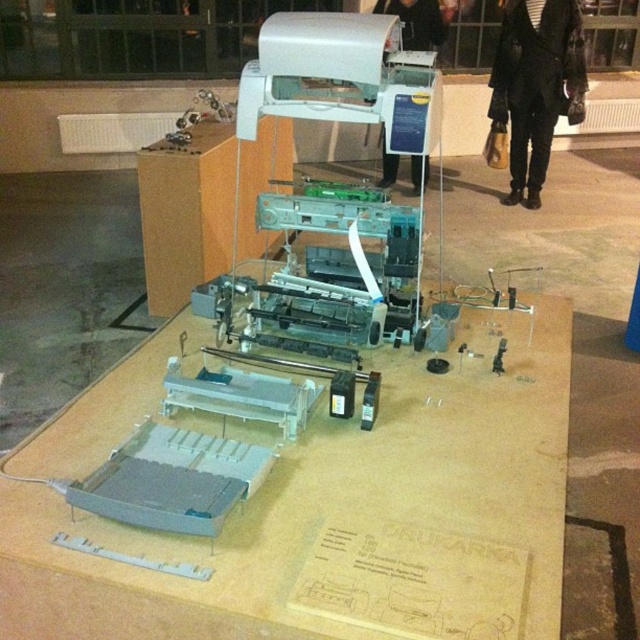
Question: Does white plastic printer at upper center appear on the right side of matte plastic table at center?

Choices:
 (A) no
 (B) yes

Answer: (B)

Question: Is matte gray plastic table at center wider than white plastic printer at upper center?

Choices:
 (A) no
 (B) yes

Answer: (B)

Question: Which of the following is the closest to the observer?

Choices:
 (A) (280, 68)
 (B) (557, 531)
 (C) (193, 227)

Answer: (B)

Question: Is matte gray plastic table at center positioned at the back of matte plastic table at center?

Choices:
 (A) yes
 (B) no

Answer: (B)

Question: Which point is farther to the camera?

Choices:
 (A) (170, 260)
 (B) (310, 86)
 (C) (381, 432)

Answer: (A)

Question: Among these points, which one is farthest from the camera?

Choices:
 (A) (387, 88)
 (B) (211, 256)

Answer: (B)